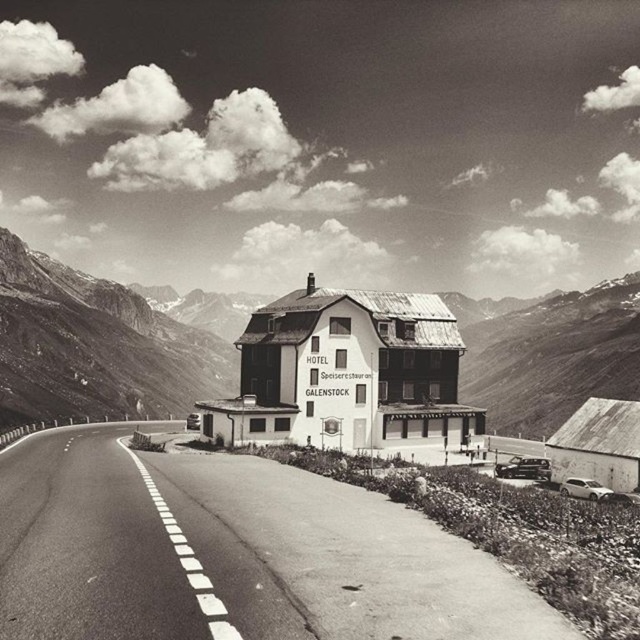
Can you confirm if asphalt road at center is positioned to the right of rugged stone mountain at center?

Incorrect, asphalt road at center is not on the right side of rugged stone mountain at center.

Who is higher up, asphalt road at center or rugged stone mountain at center?

rugged stone mountain at center

Describe the element at coordinates (339, 557) in the screenshot. I see `asphalt road at center` at that location.

Where is `asphalt road at center`? asphalt road at center is located at coordinates (339, 557).